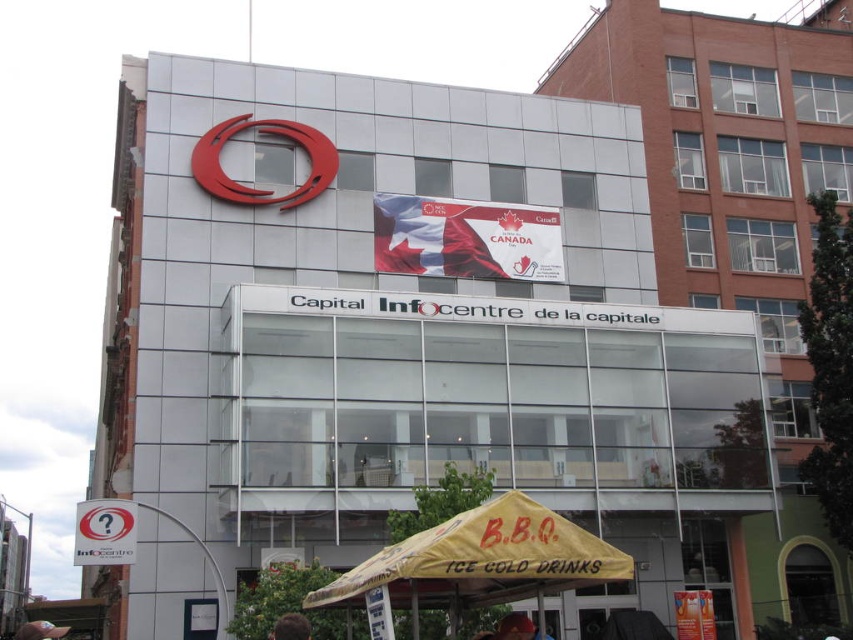
You are a customer looking for the BBQ stand. You see a white paper sign at lower left and a brown hair at lower center. Which object is bigger?

The white paper sign at lower left is larger in size than brown hair at lower center.

You are a visitor at the Capital Infocentre de la capitale and see the white paper sign at lower left and the brown hair at lower center. Which object is positioned higher in the scene?

The white paper sign at lower left is located above the brown hair at lower center, so it is positioned higher in the scene.